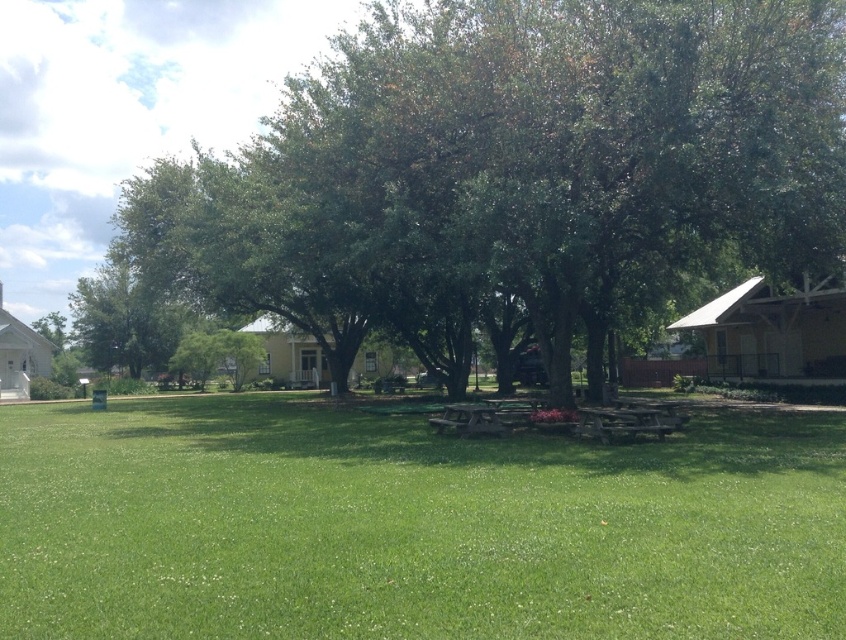
Consider the image. Who is more forward, (827, 54) or (74, 465)?

Point (74, 465) is in front.

Does green leafy tree at center appear on the right side of green grass at center?

No, green leafy tree at center is not to the right of green grass at center.

In order to click on green leafy tree at center in this screenshot , I will do [x=511, y=170].